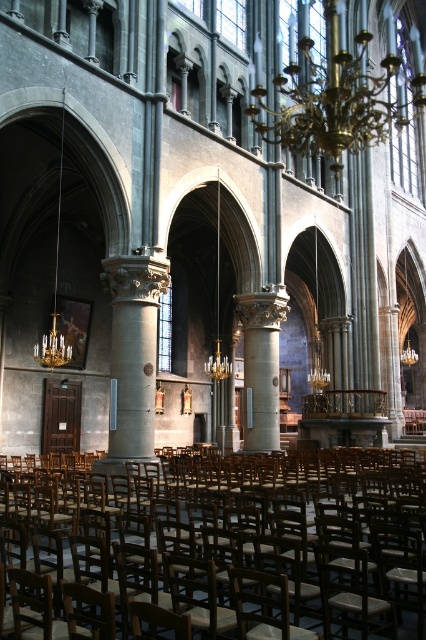
Question: Does wooden chair at center appear on the right side of gold metallic chandelier at upper center?

Choices:
 (A) no
 (B) yes

Answer: (A)

Question: Which point is closer to the camera?

Choices:
 (A) (264, 490)
 (B) (385, 54)

Answer: (A)

Question: Which object appears farthest from the camera in this image?

Choices:
 (A) gold metallic chandelier at upper center
 (B) wooden chair at center

Answer: (A)

Question: Can you confirm if wooden chair at center is smaller than gold metallic chandelier at upper center?

Choices:
 (A) yes
 (B) no

Answer: (A)

Question: Does wooden chair at center have a smaller size compared to gold metallic chandelier at upper center?

Choices:
 (A) yes
 (B) no

Answer: (A)

Question: Which of the following is the closest to the observer?

Choices:
 (A) (276, 550)
 (B) (414, 90)

Answer: (A)